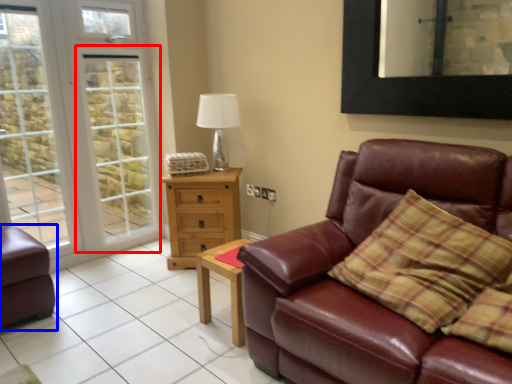
Question: Which point is closer to the camera, screen door (highlighted by a red box) or studio couch (highlighted by a blue box)?

Choices:
 (A) screen door
 (B) studio couch

Answer: (B)